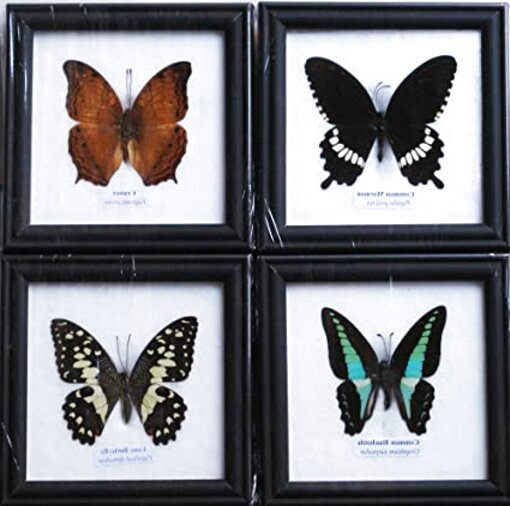
The width and height of the screenshot is (510, 506). I want to click on black picture frames, so click(240, 27), click(275, 28), click(237, 278), click(267, 279).